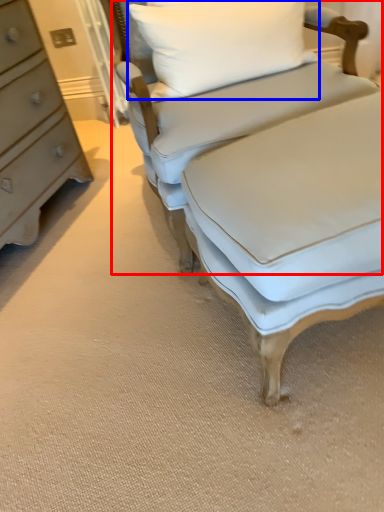
Question: Among these objects, which one is nearest to the camera, studio couch (highlighted by a red box) or pillow (highlighted by a blue box)?

Choices:
 (A) studio couch
 (B) pillow

Answer: (A)